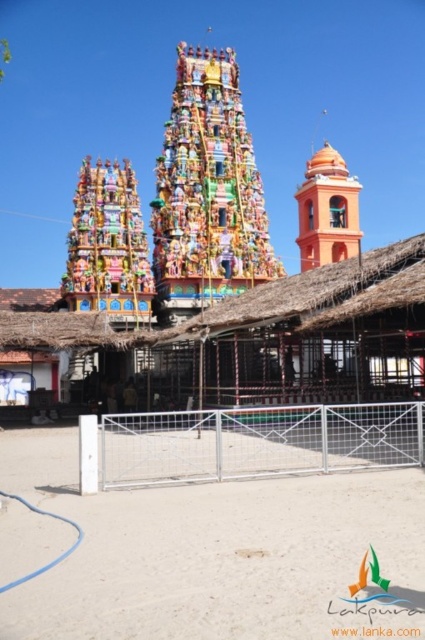
You are standing at the camera position and want to take a photo of the multicolored painted temple at center. If your camera has a maximum focus range of 300 feet, will you be able to capture the temple clearly?

The multicolored painted temple at center and camera are 304.84 feet apart. Since the distance exceeds the camera maximum focus range of 300 feet, the camera cannot focus properly on the temple, so the photo may be blurry.

You are a visitor standing at the entrance of the temple grounds. You see the thatched straw hut at center and the orange matte bell tower at upper right. Which structure is wider from your vantage point?

The thatched straw hut at center might be wider than orange matte bell tower at upper right according to the description.

You are standing at the point marked as point (206, 193) in the image. What is the closest object to you?

The closest object to you at point (206, 193) is the multicolored painted temple at center, as it is located exactly at that coordinate.